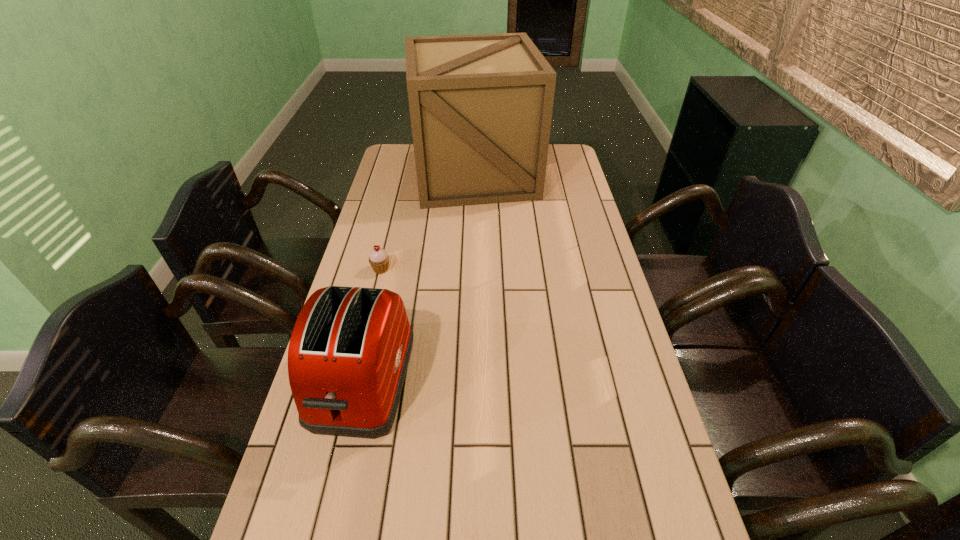
You are a GUI agent. You are given a task and a screenshot of the screen. Output one action in this format:
    pyautogui.click(x=<x>, y=<y>)
    Task: Click on the box present at the left edge
    
    Given the screenshot: What is the action you would take?
    pyautogui.click(x=481, y=105)

What are the coordinates of `toaster present at the left edge` in the screenshot? It's located at (349, 351).

The width and height of the screenshot is (960, 540). Find the location of `cupcake that is at the left edge`. cupcake that is at the left edge is located at coordinates (379, 259).

This screenshot has height=540, width=960. I want to click on object located in the right edge section of the desktop, so click(481, 105).

Where is `object that is at the far left corner`? The height and width of the screenshot is (540, 960). object that is at the far left corner is located at coordinates (481, 105).

Identify the location of object situated at the far right corner. This screenshot has height=540, width=960. (481, 105).

The width and height of the screenshot is (960, 540). Find the location of `vacant space at the left edge`. vacant space at the left edge is located at coordinates (401, 220).

Locate an element on the screen. free location at the right edge is located at coordinates (600, 367).

The image size is (960, 540). I want to click on vacant space at the far left corner, so click(413, 145).

In order to click on free space at the far right corner of the desktop in this screenshot , I will do `click(565, 150)`.